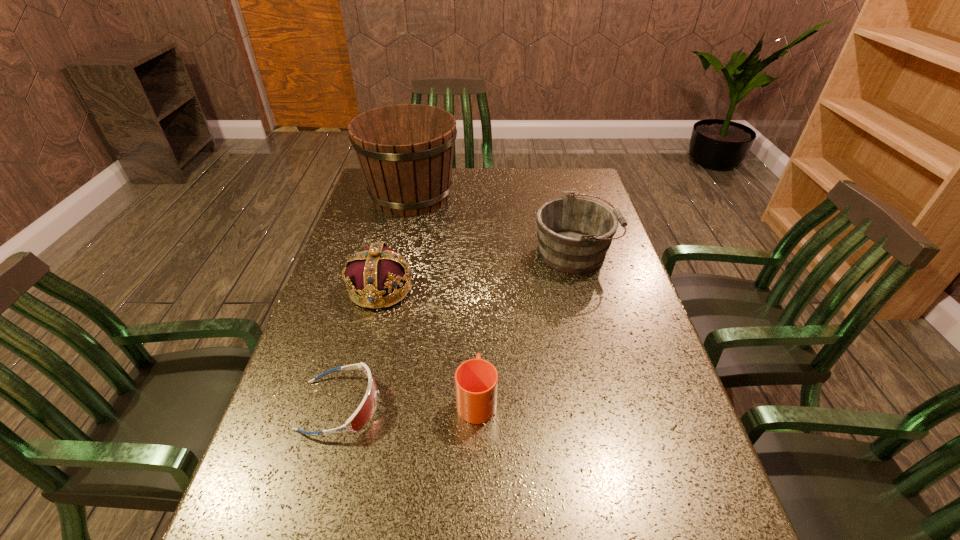
You are a GUI agent. You are given a task and a screenshot of the screen. Output one action in this format:
    pyautogui.click(x=<x>, y=<y>)
    Task: Click on the free space located 0.290m on the front of the crown
    
    Given the screenshot: What is the action you would take?
    pyautogui.click(x=348, y=416)

Locate an element on the screen. The height and width of the screenshot is (540, 960). blank space located on the handle side of the second shortest object is located at coordinates (477, 322).

Image resolution: width=960 pixels, height=540 pixels. What are the coordinates of `vacant space located on the handle side of the second shortest object` in the screenshot? It's located at pyautogui.click(x=477, y=325).

Locate an element on the screen. Image resolution: width=960 pixels, height=540 pixels. vacant space located on the handle side of the second shortest object is located at coordinates (477, 271).

In order to click on free space located 0.290m on the front-facing side of the goggles in this screenshot , I will do `click(517, 406)`.

Where is `object present at the far edge`? The width and height of the screenshot is (960, 540). object present at the far edge is located at coordinates (405, 152).

Locate an element on the screen. wine bucket at the left edge is located at coordinates 405,152.

Locate an element on the screen. The height and width of the screenshot is (540, 960). crown that is positioned at the left edge is located at coordinates (372, 273).

At what (x,y) coordinates should I click in order to perform the action: click on goggles present at the left edge. Please return your answer as a coordinate pair (x, y). Looking at the image, I should click on (365, 411).

The image size is (960, 540). What are the coordinates of `object that is at the right edge` in the screenshot? It's located at (574, 234).